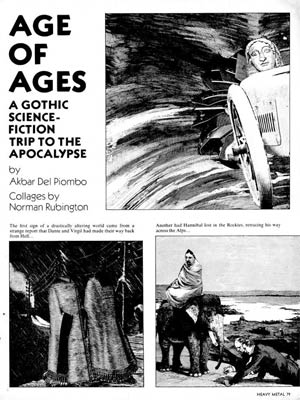
You are a GUI agent. You are given a task and a screenshot of the screen. Output one action in this format:
    pyautogui.click(x=<x>, y=<y>)
    Task: Click on the magazine page
    The width and height of the screenshot is (300, 400).
    Given the screenshot: What is the action you would take?
    pyautogui.click(x=79, y=176)